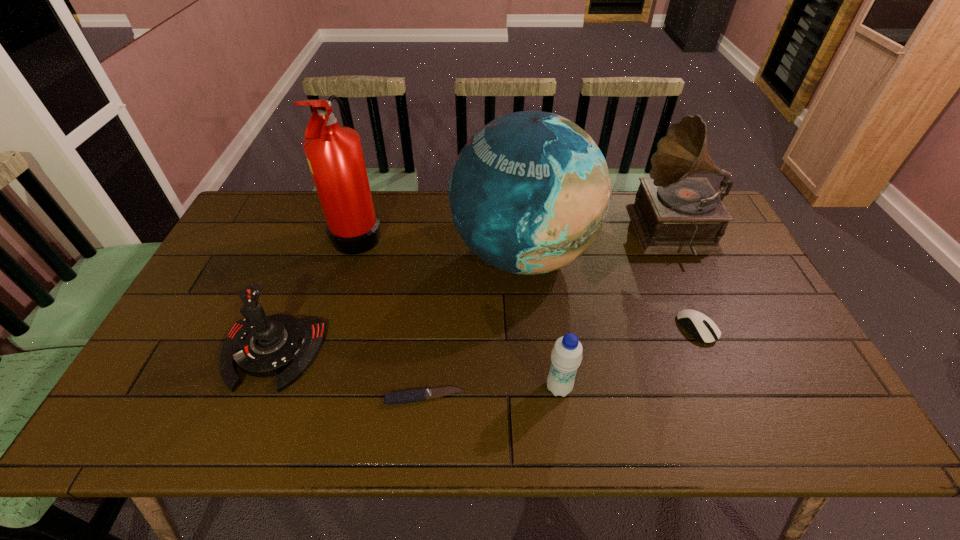
Where is `vacant space located from the horn of the record player`? vacant space located from the horn of the record player is located at coordinates (588, 234).

The height and width of the screenshot is (540, 960). I want to click on vacant space located 0.160m from the horn of the record player, so click(x=588, y=234).

The image size is (960, 540). In order to click on blank area located on the left of the water bottle in this screenshot , I will do pos(503,388).

I want to click on free space located on the back of the second shortest object, so click(x=651, y=220).

You are a GUI agent. You are given a task and a screenshot of the screen. Output one action in this format:
    pyautogui.click(x=<x>, y=<y>)
    Task: Click on the blank area located on the right of the shortest object
    Image resolution: width=960 pixels, height=540 pixels.
    Given the screenshot: What is the action you would take?
    pyautogui.click(x=559, y=397)

At what (x,y) coordinates should I click in order to perform the action: click on fire extinguisher located in the far edge section of the desktop. Please return your answer as a coordinate pair (x, y). Looking at the image, I should click on (334, 153).

At what (x,y) coordinates should I click in order to perform the action: click on globe that is at the far edge. Please return your answer as a coordinate pair (x, y). Looking at the image, I should click on (529, 193).

Locate an element on the screen. The image size is (960, 540). record player at the far edge is located at coordinates (672, 214).

Find the location of `object that is at the near edge`. object that is at the near edge is located at coordinates (401, 397).

Find the location of a particular element. object present at the left edge is located at coordinates (262, 346).